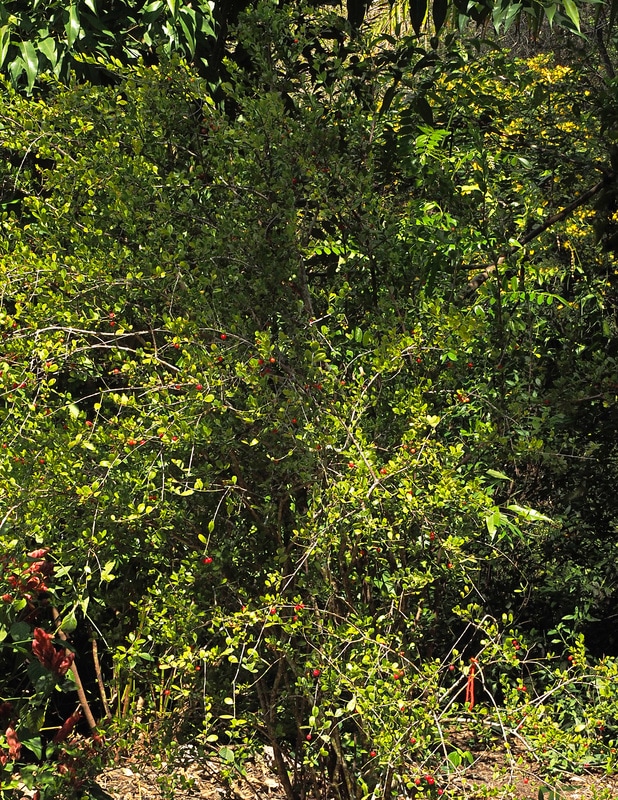
What are the coordinates of `shade` in the screenshot? It's located at (85, 656).